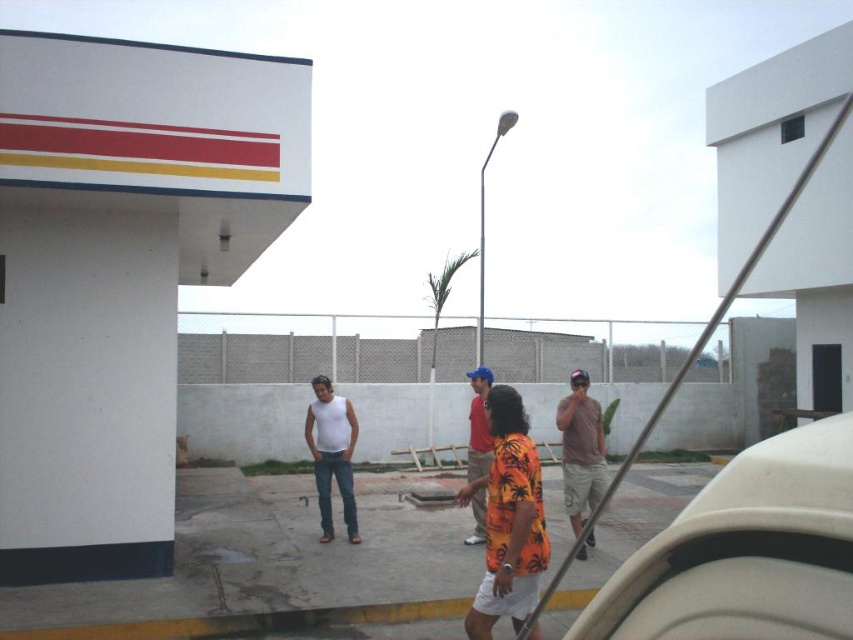
I want to click on brown cotton shirt at center, so click(x=579, y=451).

From the picture: Who is more forward, (x=585, y=392) or (x=471, y=472)?

Point (x=471, y=472) is more forward.

Identify the location of brown cotton shirt at center. (579, 451).

Which is behind, point (518, 456) or point (575, 467)?

Positioned behind is point (575, 467).

Can you confirm if orange palm print shirt at center is positioned to the right of brown cotton shirt at center?

In fact, orange palm print shirt at center is to the left of brown cotton shirt at center.

Measure the distance between orange palm print shirt at center and camera.

orange palm print shirt at center is 12.05 feet away from camera.

You are a GUI agent. You are given a task and a screenshot of the screen. Output one action in this format:
    pyautogui.click(x=<x>, y=<y>)
    Task: Click on the orange palm print shirt at center
    This screenshot has height=640, width=853.
    Given the screenshot: What is the action you would take?
    pyautogui.click(x=508, y=518)

Does white plastic car at right have a lesser width compared to orange palm print shirt at center?

No.

How far apart are white plastic car at right and orange palm print shirt at center?

white plastic car at right is 7.95 feet from orange palm print shirt at center.

The width and height of the screenshot is (853, 640). In order to click on white plastic car at right in this screenshot , I will do `click(746, 552)`.

Identify the location of white plastic car at right. This screenshot has height=640, width=853. (746, 552).